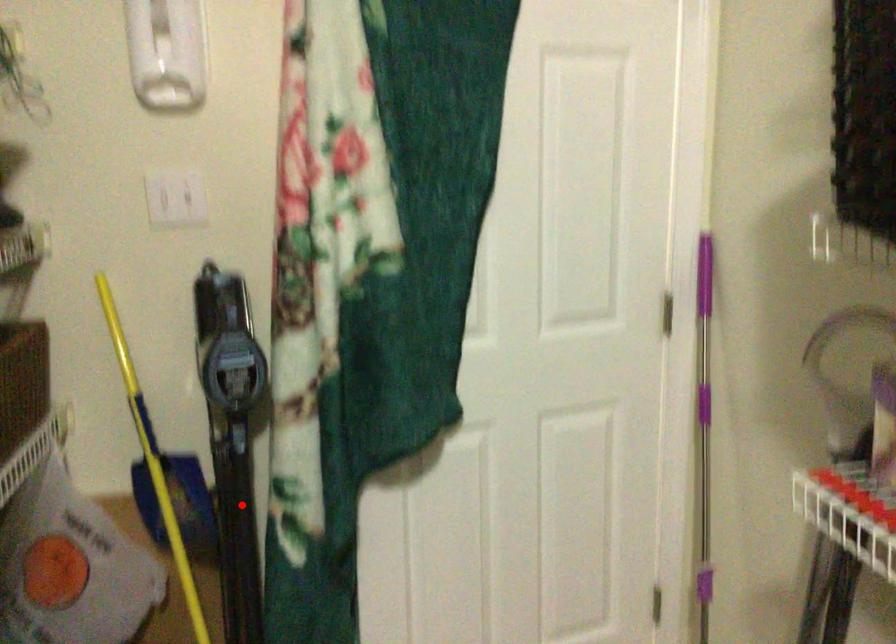
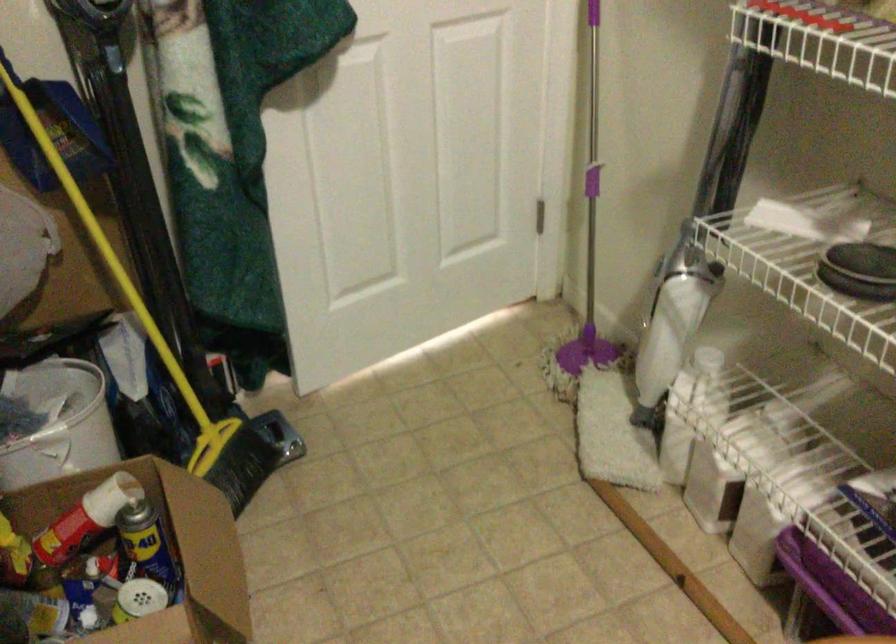
Where in the second image is the point corresponding to the highlighted location from the first image?

(135, 140)